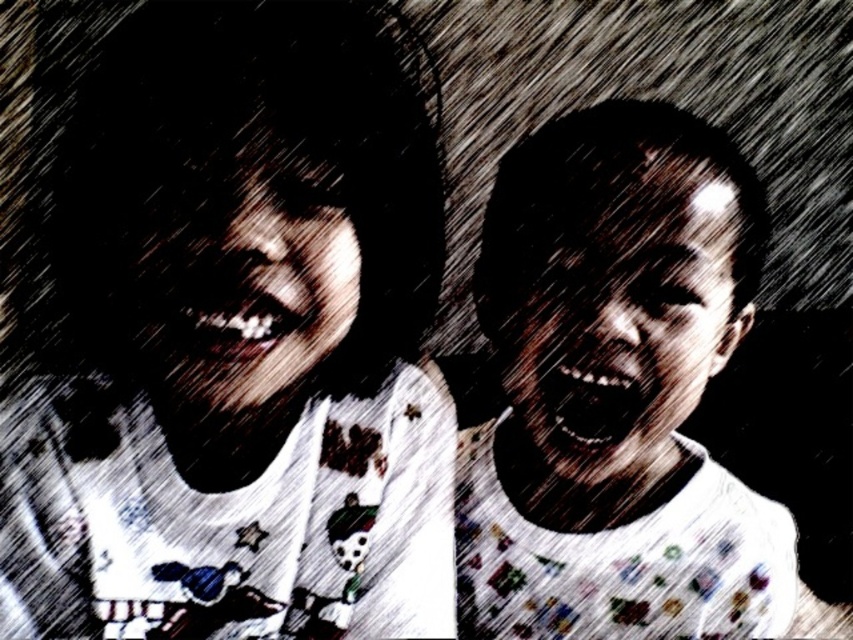
You are designing a layout for a magazine spread and need to place two images side by side. The first image shows a white printed shirt at upper left, and the second shows a matte white shirt at right. Based on their sizes, which shirt should be placed first to maintain visual balance?

The white printed shirt at upper left should be placed first because it is wider than the matte white shirt at right, helping to balance the layout by starting with a larger element.

You are a photographer trying to focus on the closest object in the image. Which of the two shirts, the white printed shirt at upper left or the matte white shirt at right, should you adjust your camera to focus on?

The white printed shirt at upper left is closer to the viewer than the matte white shirt at right, so you should focus on the white printed shirt at upper left.

You are holding a 50 cm ruler. If you place one end at your eye level and align it with the point at coordinates point (206, 316) in the image, will the ruler reach the point?

The point at coordinates point (206, 316) is 49.83 centimeters away from the viewer. Since the ruler is exactly 50 cm long, it will almost reach the point, but fall short by approximately 0.17 centimeters.